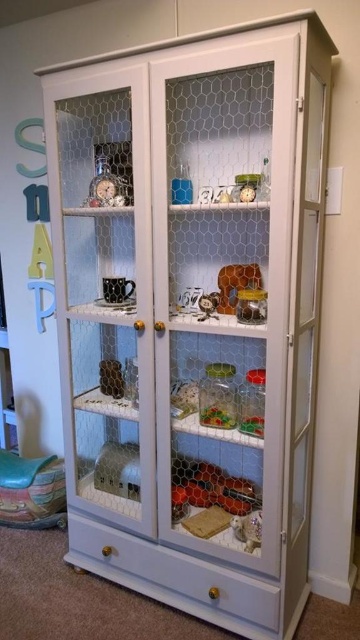
You are standing in front of the vintage cabinet and want to reach the white plush bear at lower center. The average adult arm length is 2.5 feet. Can you reach the bear without moving your feet?

The white plush bear at lower center is 5.63 feet away from the camera. Since the average adult arm length is only 2.5 feet, you cannot reach the bear without moving your feet.